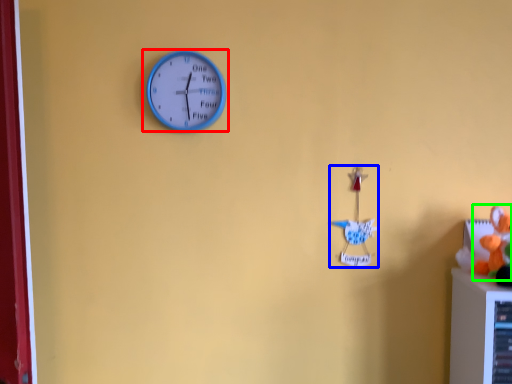
Question: Considering the real-world distances, which object is closest to wall clock (highlighted by a red box)? toy (highlighted by a blue box) or toy (highlighted by a green box).

Choices:
 (A) toy
 (B) toy

Answer: (A)